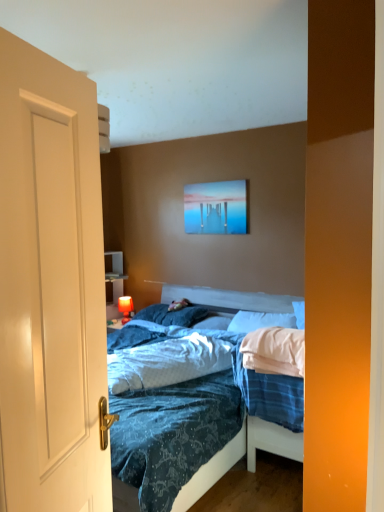
Question: Is pillow at center, arranged as the first pillow when viewed from the right, taller or shorter than white matte door at left?

Choices:
 (A) tall
 (B) short

Answer: (B)

Question: Would you say pillow at center, marked as the third pillow in a left-to-right arrangement, is to the left or to the right of white matte door at left in the picture?

Choices:
 (A) left
 (B) right

Answer: (B)

Question: Considering the real-world distances, which object is closest to the matte orange lamp at left?

Choices:
 (A) acrylic painting at upper center
 (B) white matte door at left
 (C) blue soft pillow at center, positioned as the 1th pillow in left-to-right order
 (D) pillow at center, arranged as the first pillow when viewed from the right
 (E) white soft pillow at center, arranged as the 2th pillow when viewed from the right

Answer: (C)

Question: Considering the real-world distances, which object is farthest from the white matte door at left?

Choices:
 (A) blue soft pillow at center, positioned as the 1th pillow in left-to-right order
 (B) matte orange lamp at left
 (C) pillow at center, arranged as the first pillow when viewed from the right
 (D) blue textured fabric at center
 (E) acrylic painting at upper center

Answer: (B)